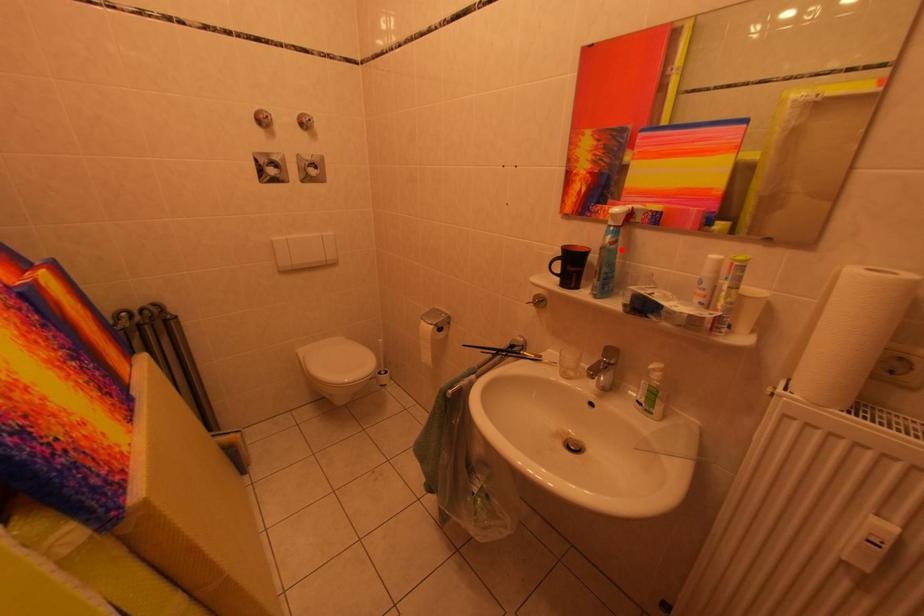
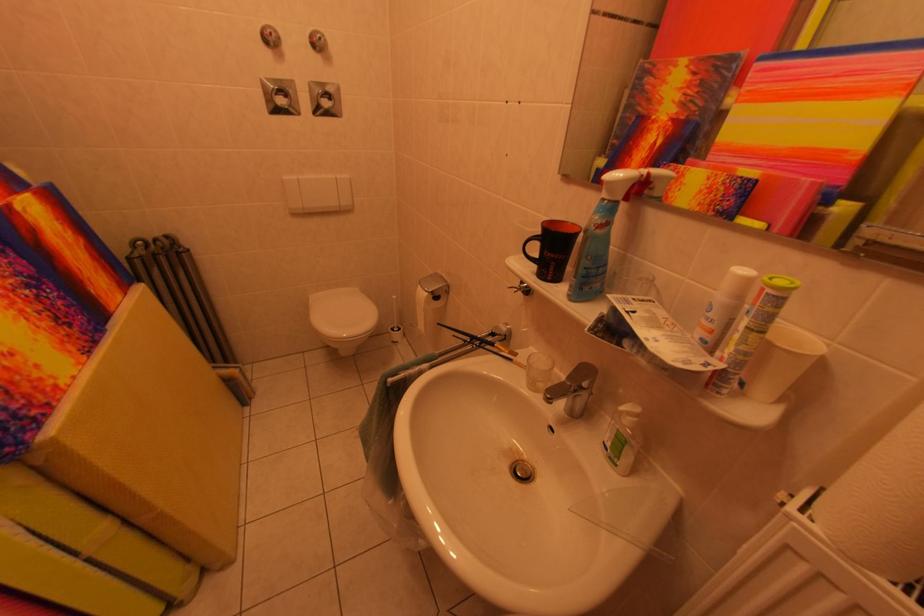
Find the pixel in the second image that matches the highlighted location in the first image.

(606, 235)